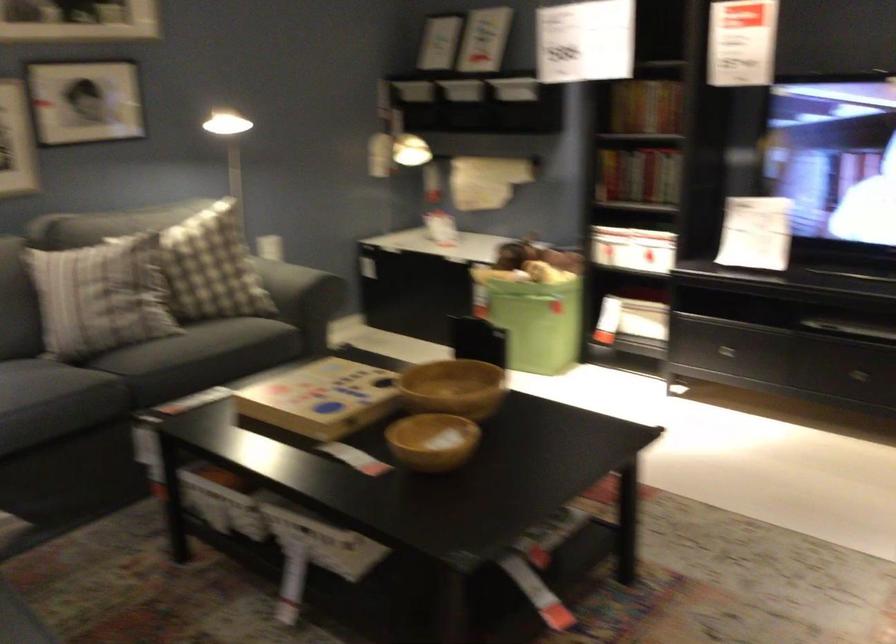
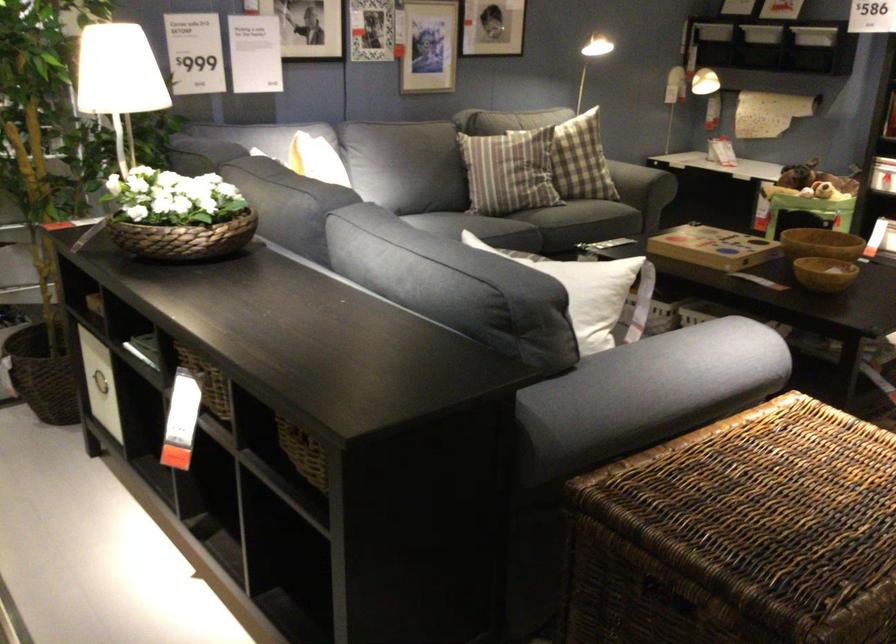
Where in the second image is the point corresponding to pixel 400 456 from the first image?

(823, 272)